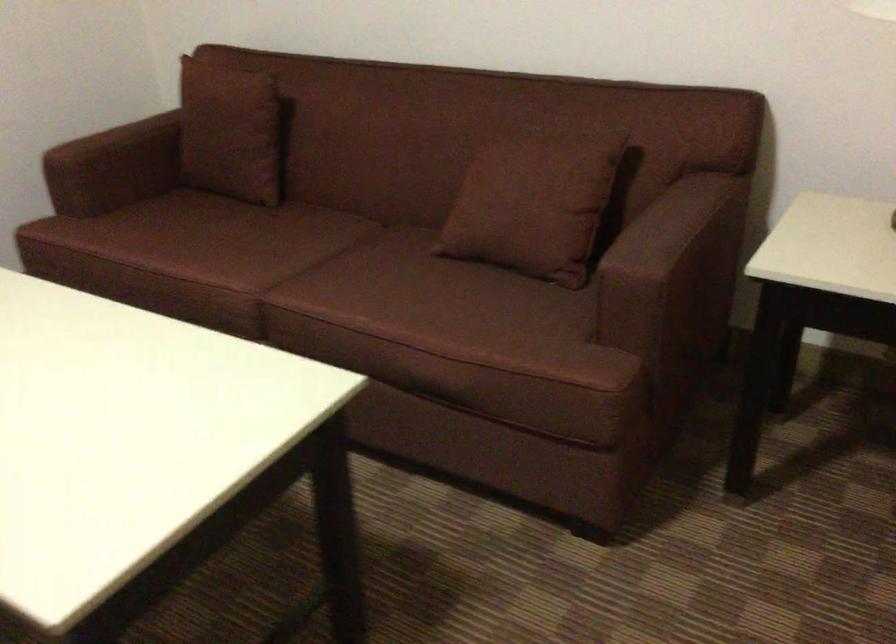
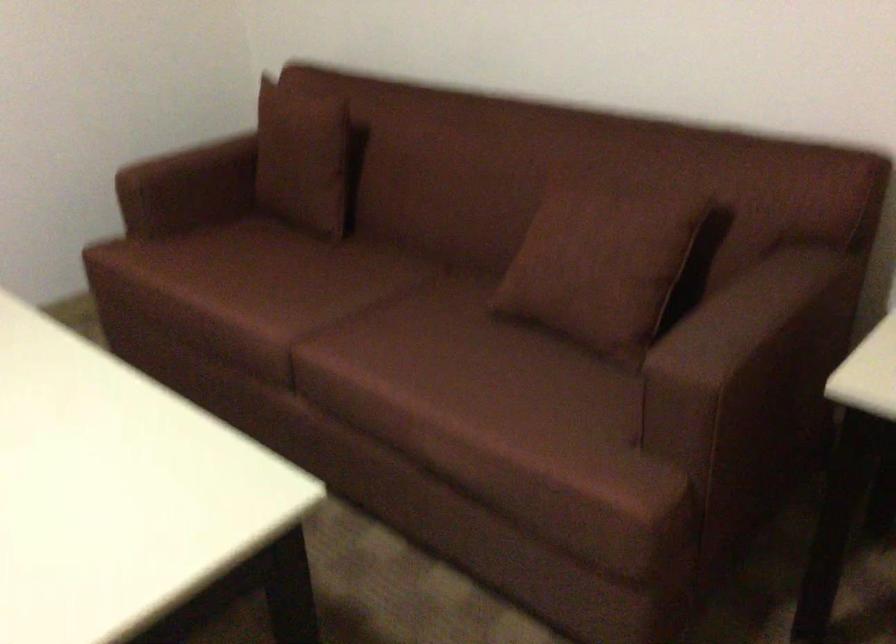
In a continuous first-person perspective shot, in which direction is the camera moving?

The cameraman walked toward right, forward.